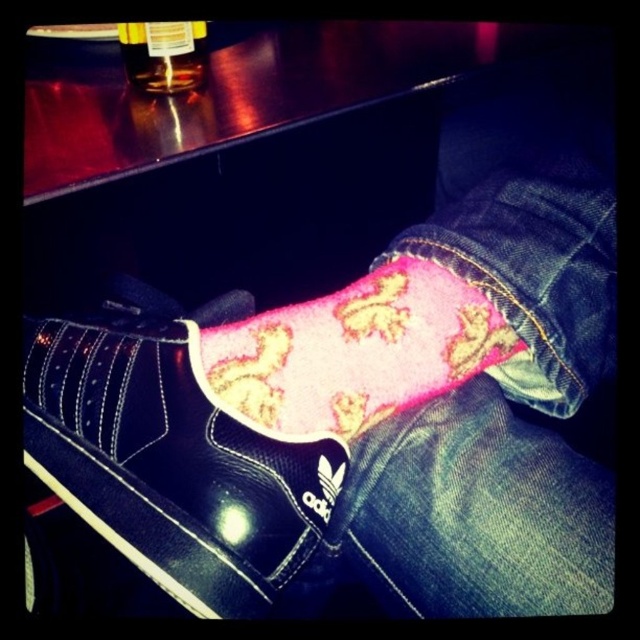
You are organizing items on a shelf and notice the black leather shoe at center and the translucent plastic bottle at upper left. According to the image, which item is positioned higher up?

The translucent plastic bottle at upper left is positioned higher up than the black leather shoe at center.

In the scene shown: You are a photographer setting up a shoot. You have a pink fleece jeans at center and a translucent plastic bottle at upper left in your frame. Where should you position your camera to ensure both objects are in focus?

Position your camera so it can capture both the pink fleece jeans at center and the translucent plastic bottle at upper left. Since the pink fleece jeans at center is under the translucent plastic bottle at upper left, adjusting the camera angle to include both from an elevated or side perspective would keep them in focus.

You are a delivery robot that needs to place a small package between the black leather shoe at center and the translucent plastic bottle at upper left. Can you fit it there if the package is 18 inches long?

The distance between the black leather shoe at center and the translucent plastic bottle at upper left is 18.28 inches, so yes, the package can fit since it is slightly shorter than the available space.